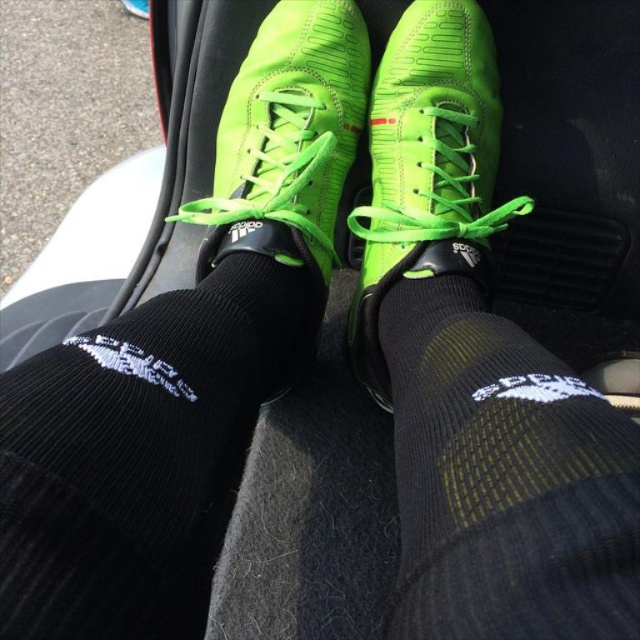
You are a passenger in a car and want to place a small item on the floor. You see two points on the floor marked as point 1 and point 2. The coordinates for point 1 are point (564,579) and point 2 are point (273,221). Based on the image, which point is closer to the front of the car?

Point 1 at coordinates point (564,579) is closer to the front of the car because it is in front of point 2 at coordinates point (273,221).

You are a shoe designer observing the image of a person sitting in a car. You need to determine the spatial relationship between the black textured sock at center and the neon green leather shoe at center. Which object is positioned lower in this scene?

The black textured sock at center is located below the neon green leather shoe at center, so the sock is positioned lower.

You are a GPS device in the car. You need to guide the driver to place their right foot on the brake pedal, which is located at the point with coordinates point (140, 452). However, the driver currently has their right foot resting on the bright green soccer cleats with white laces at lower center. Where should the driver move their right foot to reach the brake pedal?

The point (140, 452) is on black ribbed sock at center, so the driver should move their right foot from the bright green soccer cleats with white laces at lower center to the area where the black ribbed sock at center is located to reach the brake pedal.